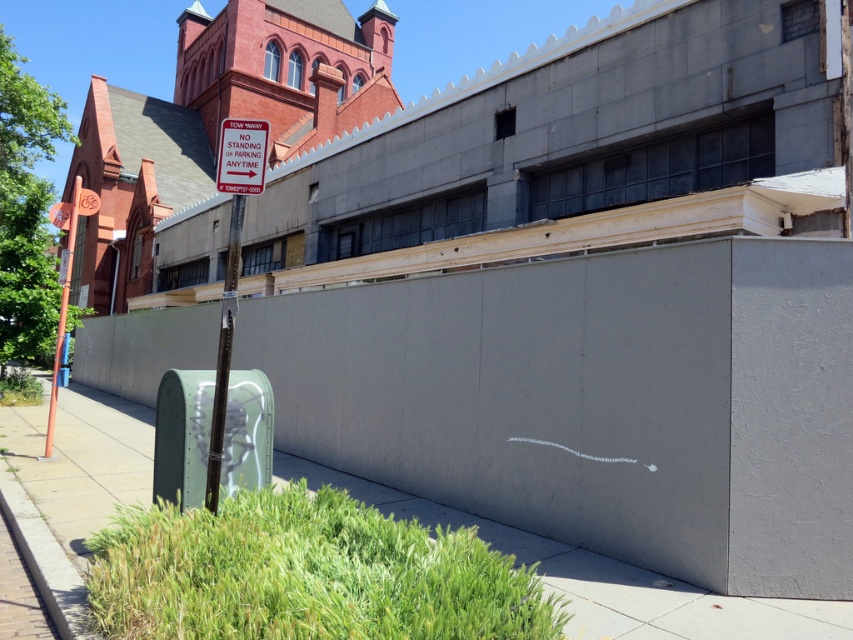
You are a delivery person trying to find the shortest path to the brick church at upper left from the smooth concrete pavement at lower center. Which direction should you head?

The brick church at upper left is positioned over smooth concrete pavement at lower center, so you should head upwards from the smooth concrete pavement at lower center to reach the brick church at upper left.

You are a pedestrian standing on the smooth concrete pavement at lower center and want to take a photo of the brick church at upper left. Which direction should you face to capture the church in your camera?

You should face to the left because the brick church at upper left is located to the left of the smooth concrete pavement at lower center where you are standing.

You are a city planner assessing the urban layout. Considering the brick church at upper left and the smooth concrete pavement at lower center, which structure is higher in elevation?

The brick church at upper left is taller than the smooth concrete pavement at lower center, so the brick church at upper left is higher in elevation.